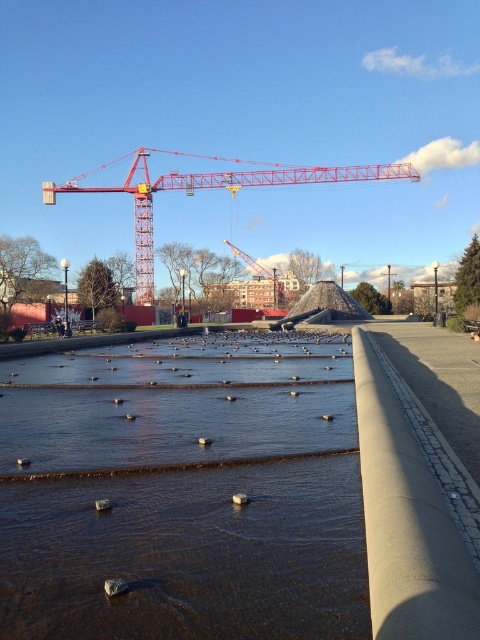
Which is below, clear water at center or metallic red crane at center?

Positioned lower is clear water at center.

Consider the image. Who is positioned more to the right, clear water at center or metallic red crane at center?

Positioned to the right is clear water at center.

Is point (68, 480) farther from camera compared to point (146, 272)?

No, (68, 480) is in front of (146, 272).

This screenshot has width=480, height=640. Find the location of `clear water at center`. clear water at center is located at coordinates (182, 499).

From the picture: Can you confirm if metallic red crane at center is positioned to the right of red metallic crane at center?

No, metallic red crane at center is not to the right of red metallic crane at center.

Consider the image. Who is higher up, metallic red crane at center or red metallic crane at center?

metallic red crane at center

Where is `metallic red crane at center`? metallic red crane at center is located at coordinates (207, 188).

At what (x,y) coordinates should I click in order to perform the action: click on metallic red crane at center. Please return your answer as a coordinate pair (x, y). This screenshot has height=640, width=480. Looking at the image, I should click on (207, 188).

Can you confirm if clear water at center is taller than red metallic crane at center?

In fact, clear water at center may be shorter than red metallic crane at center.

Is point (146, 611) behind point (284, 294)?

No, it is not.

Find the location of a particular element. This screenshot has width=480, height=640. clear water at center is located at coordinates (182, 499).